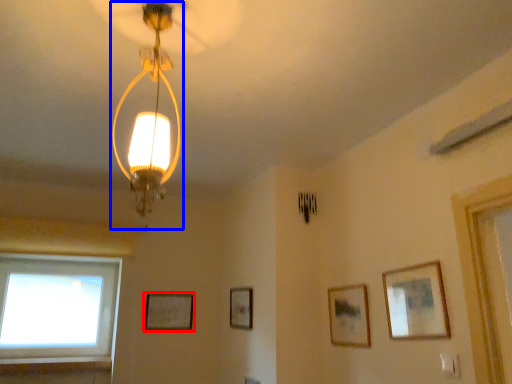
Question: Which object appears farthest to the camera in this image, picture frame (highlighted by a red box) or lamp (highlighted by a blue box)?

Choices:
 (A) picture frame
 (B) lamp

Answer: (A)